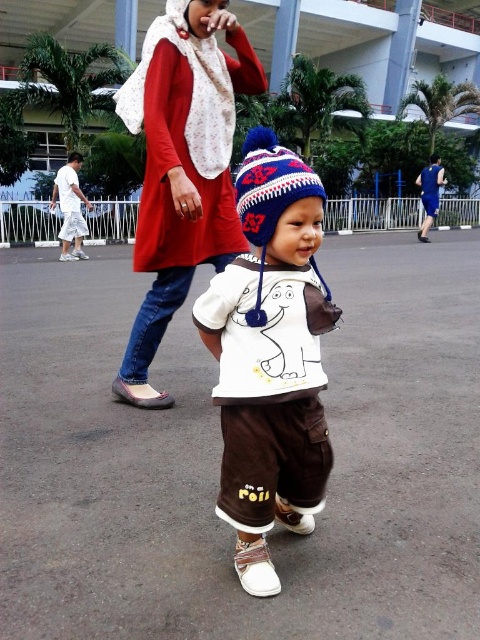
Between white cotton shirt at center and knitted woolen hat at center, which one has less height?

knitted woolen hat at center

Locate an element on the screen. white cotton shirt at center is located at coordinates (271, 356).

Does point (210, 296) come in front of point (245, 154)?

No, (210, 296) is behind (245, 154).

Locate an element on the screen. The height and width of the screenshot is (640, 480). white cotton shirt at center is located at coordinates point(271,356).

Looking at this image, between white cotton shirt at center and matte red dress at center, which one appears on the right side from the viewer's perspective?

From the viewer's perspective, white cotton shirt at center appears more on the right side.

The width and height of the screenshot is (480, 640). Describe the element at coordinates (271, 356) in the screenshot. I see `white cotton shirt at center` at that location.

Between point (285, 365) and point (241, 77), which one is positioned in front?

Point (285, 365) is more forward.

Where is `white cotton shirt at center`? Image resolution: width=480 pixels, height=640 pixels. white cotton shirt at center is located at coordinates (271, 356).

Is point (183, 273) positioned in front of point (67, 200)?

Yes, point (183, 273) is in front of point (67, 200).

This screenshot has width=480, height=640. I want to click on matte red dress at center, so click(x=181, y=168).

Identify the location of matte red dress at center. (181, 168).

Find the location of a particular element. matte red dress at center is located at coordinates (181, 168).